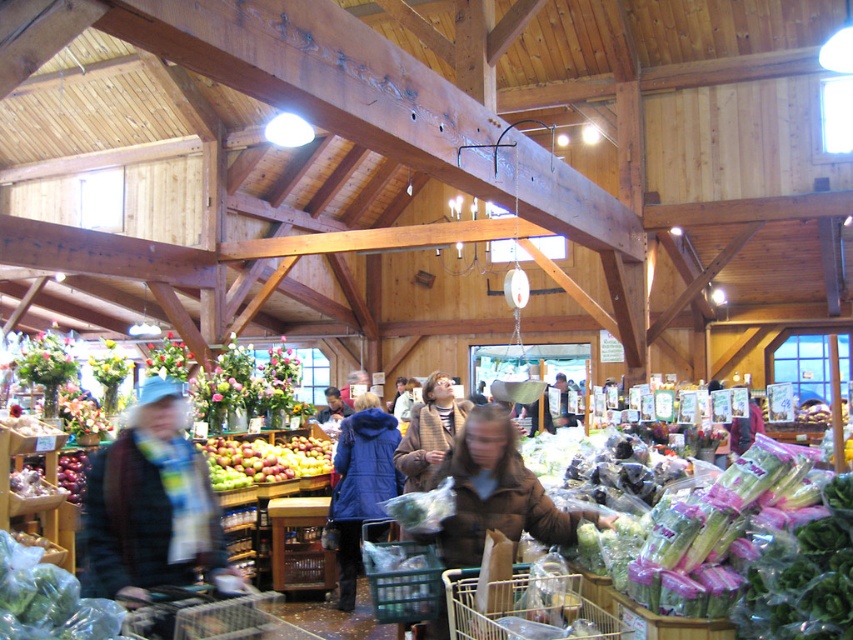
You are a customer in the market holding a metallic wire basket at lower center. You notice a blue woolen scarf at left hanging nearby. If you want to place the scarf into the basket, will the scarf fit inside the basket based on their widths?

The blue woolen scarf at left might be wider than metallic wire basket at lower center, so there is a possibility that the scarf will not fit inside the basket if its width exceeds the basket.

You are a customer in the market and want to find the shorter coat between the brown fuzzy coat at center and the blue matte coat at center. Which one should you look for?

The brown fuzzy coat at center is shorter than the blue matte coat at center, so you should look for the brown fuzzy coat at center.